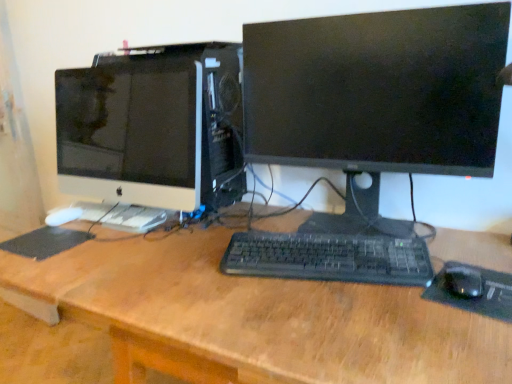
This screenshot has width=512, height=384. Identify the location of vacant area on the back side of black rubber mousepad at lower right, which ranks as the 2th mousepad in back-to-front order. (466, 246).